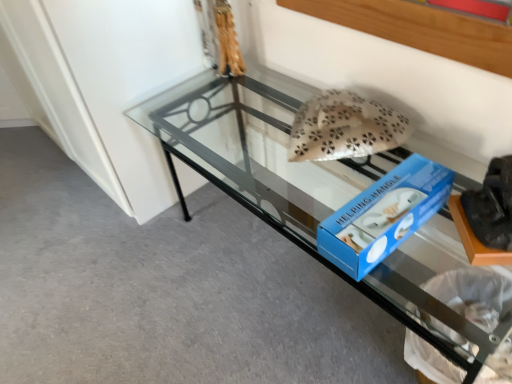
This screenshot has width=512, height=384. Describe the element at coordinates (255, 149) in the screenshot. I see `clear glass table at center` at that location.

The image size is (512, 384). I want to click on clear glass table at center, so click(x=255, y=149).

This screenshot has height=384, width=512. What do you see at coordinates (344, 127) in the screenshot? I see `beige fabric pillow at center` at bounding box center [344, 127].

In order to face beige fabric pillow at center, should I rotate leftwards or rightwards?

Rotate right and turn 10.464 degrees.

This screenshot has width=512, height=384. In order to click on beige fabric pillow at center in this screenshot , I will do `click(344, 127)`.

This screenshot has width=512, height=384. I want to click on clear glass table at center, so click(x=255, y=149).

Considering the positions of objects clear glass table at center and beige fabric pillow at center in the image provided, who is more to the left, clear glass table at center or beige fabric pillow at center?

Positioned to the left is clear glass table at center.

Is clear glass table at center positioned behind beige fabric pillow at center?

No, the depth of clear glass table at center is less than that of beige fabric pillow at center.

Which is less distant, (448, 314) or (323, 94)?

Positioned in front is point (448, 314).

From the image's perspective, is clear glass table at center under beige fabric pillow at center?

Correct, clear glass table at center appears lower than beige fabric pillow at center in the image.

From a real-world perspective, does clear glass table at center stand above beige fabric pillow at center?

No.

From the picture: Between clear glass table at center and beige fabric pillow at center, which one has larger width?

clear glass table at center is wider.

Does clear glass table at center have a lesser height compared to beige fabric pillow at center?

Incorrect, the height of clear glass table at center does not fall short of that of beige fabric pillow at center.

Can you confirm if clear glass table at center is smaller than beige fabric pillow at center?

No, clear glass table at center is not smaller than beige fabric pillow at center.

In the scene shown: Choose the correct answer: Is clear glass table at center inside beige fabric pillow at center or outside it?

clear glass table at center exists outside the volume of beige fabric pillow at center.

Is clear glass table at center far away from beige fabric pillow at center?

No.

Is clear glass table at center oriented towards beige fabric pillow at center?

No, clear glass table at center is not oriented towards beige fabric pillow at center.

Can you tell me how much clear glass table at center and beige fabric pillow at center differ in facing direction?

The angular difference between clear glass table at center and beige fabric pillow at center is 0.749 degrees.

Locate an element on the screen. The height and width of the screenshot is (384, 512). stuff above the clear glass table at center (from a real-world perspective) is located at coordinates (344, 127).

Does beige fabric pillow at center appear on the right side of clear glass table at center?

Yes.

Is beige fabric pillow at center further to camera compared to clear glass table at center?

That is True.

Is point (316, 149) closer to viewer compared to point (316, 224)?

No.

From the image's perspective, between beige fabric pillow at center and clear glass table at center, which one is located above?

beige fabric pillow at center.

From a real-world perspective, which object stands above the other?

beige fabric pillow at center is physically above.

Does beige fabric pillow at center have a greater width compared to clear glass table at center?

In fact, beige fabric pillow at center might be narrower than clear glass table at center.

Can you confirm if beige fabric pillow at center is shorter than clear glass table at center?

Yes.

Consider the image. Who is bigger, beige fabric pillow at center or clear glass table at center?

clear glass table at center is bigger.

Choose the correct answer: Is beige fabric pillow at center inside clear glass table at center or outside it?

beige fabric pillow at center is contained in clear glass table at center.

Would you consider beige fabric pillow at center to be distant from clear glass table at center?

No, beige fabric pillow at center is in close proximity to clear glass table at center.

Is beige fabric pillow at center looking in the opposite direction of clear glass table at center?

No, clear glass table at center is not at the back of beige fabric pillow at center.

How many degrees apart are the facing directions of beige fabric pillow at center and clear glass table at center?

beige fabric pillow at center and clear glass table at center are facing 0.749 degrees away from each other.

Find the location of `furniture on the left of beige fabric pillow at center`. furniture on the left of beige fabric pillow at center is located at coordinates (255, 149).

Where is `furniture that is below the beige fabric pillow at center (from the image's perspective)`? The width and height of the screenshot is (512, 384). furniture that is below the beige fabric pillow at center (from the image's perspective) is located at coordinates (255, 149).

Identify the location of stuff located behind the clear glass table at center. The image size is (512, 384). (344, 127).